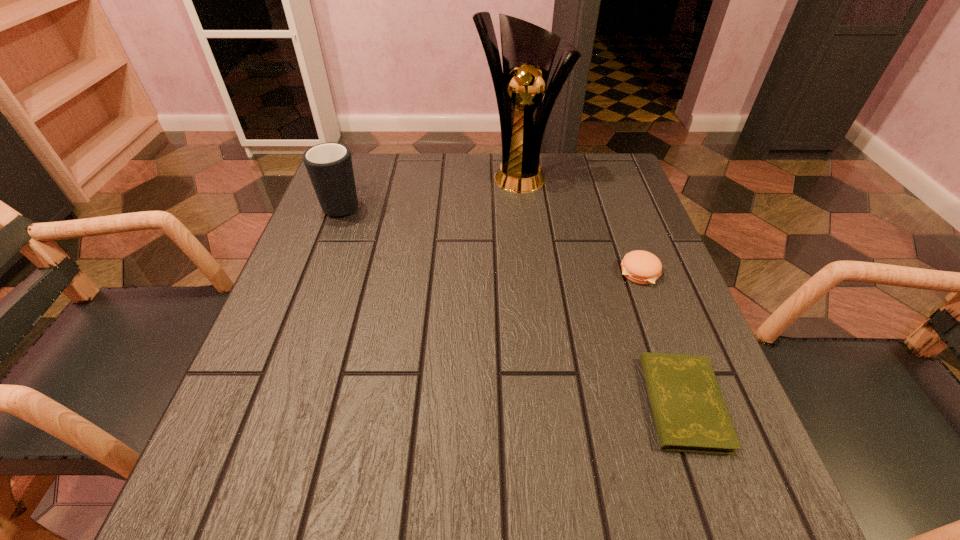
The width and height of the screenshot is (960, 540). Identify the location of free spot between the second object from left to right and the third farthest object. (579, 223).

What are the coordinates of `free space between the third object from right to left and the shortest object` in the screenshot? It's located at (601, 288).

I want to click on vacant region between the second shortest object and the shortest object, so click(x=661, y=338).

Where is `free space that is in between the second object from left to right and the nearest object`? The width and height of the screenshot is (960, 540). free space that is in between the second object from left to right and the nearest object is located at coordinates (601, 288).

This screenshot has width=960, height=540. What are the coordinates of `vacant point located between the nearest object and the second object from left to right` in the screenshot? It's located at coord(601,288).

Find the location of a particular element. free point between the shortest object and the third shortest object is located at coordinates (513, 303).

You are a GUI agent. You are given a task and a screenshot of the screen. Output one action in this format:
    pyautogui.click(x=<x>, y=<y>)
    Task: Click on the vacant area that lies between the mug and the tallest object
    The height and width of the screenshot is (540, 960).
    Given the screenshot: What is the action you would take?
    pyautogui.click(x=430, y=188)

Identify which object is the nearest to the leftmost object. Please provide its 2D coordinates. Your answer should be formatted as a tuple, i.e. [(x, y)], where the tuple contains the x and y coordinates of a point satisfying the conditions above.

[(528, 51)]

Locate an element on the screen. The width and height of the screenshot is (960, 540). the second closest object to the patty is located at coordinates (528, 51).

Image resolution: width=960 pixels, height=540 pixels. What are the coordinates of `vacant space that satisfies the following two spatial constraints: 1. at the front of the award, where the globe is visible; 2. on the left side of the patty` in the screenshot? It's located at click(x=529, y=273).